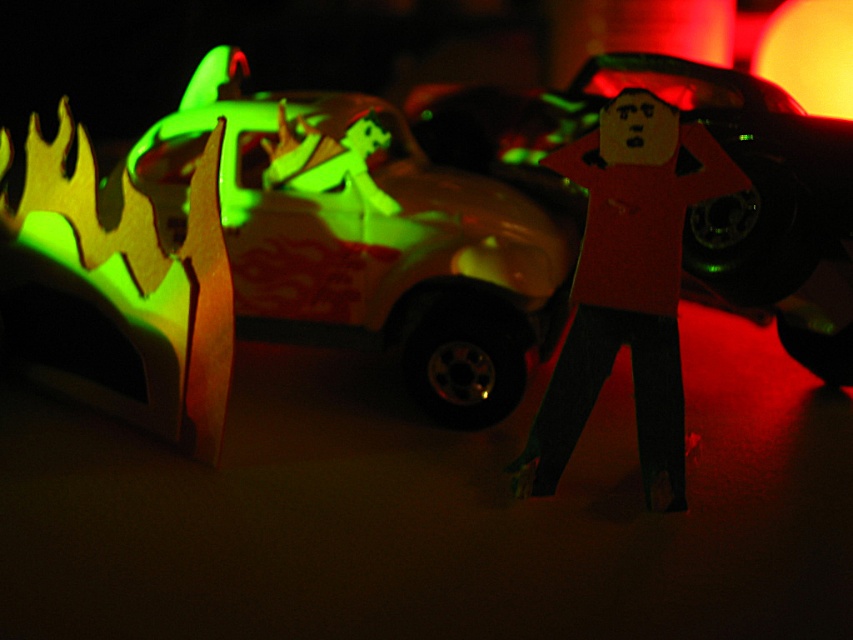
Who is shorter, fluorescent yellow cardboard flames at left or cardboard figure at center?

With less height is fluorescent yellow cardboard flames at left.

Does point (155, 314) come in front of point (628, 285)?

No, it is behind (628, 285).

You are a GUI agent. You are given a task and a screenshot of the screen. Output one action in this format:
    pyautogui.click(x=<x>, y=<y>)
    Task: Click on the fluorescent yellow cardboard flames at left
    The height and width of the screenshot is (640, 853).
    Given the screenshot: What is the action you would take?
    pyautogui.click(x=132, y=288)

Is point (163, 232) behind point (209, 282)?

Yes, point (163, 232) is behind point (209, 282).

Is point (215, 60) less distant than point (201, 424)?

No, it is behind (201, 424).

From the picture: Measure the distance between glowing plastic car at center and camera.

glowing plastic car at center is 1.31 meters away from camera.

What are the coordinates of `glowing plastic car at center` in the screenshot? It's located at (366, 237).

Does glowing plastic car at center have a larger size compared to cardboard figure at center?

Indeed, glowing plastic car at center has a larger size compared to cardboard figure at center.

Does glowing plastic car at center appear on the left side of cardboard figure at center?

Indeed, glowing plastic car at center is positioned on the left side of cardboard figure at center.

What do you see at coordinates (366, 237) in the screenshot? The width and height of the screenshot is (853, 640). I see `glowing plastic car at center` at bounding box center [366, 237].

You are a GUI agent. You are given a task and a screenshot of the screen. Output one action in this format:
    pyautogui.click(x=<x>, y=<y>)
    Task: Click on the glowing plastic car at center
    This screenshot has height=640, width=853.
    Given the screenshot: What is the action you would take?
    pyautogui.click(x=366, y=237)